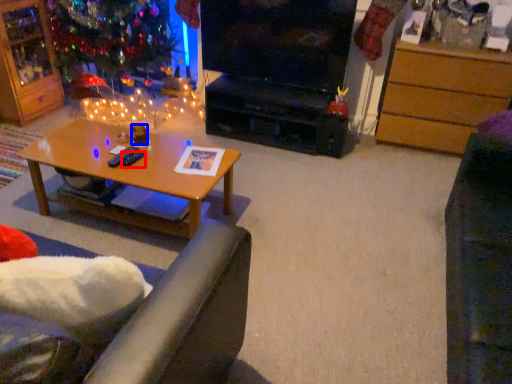
Question: Which of the following is the closest to the observer, remote control (highlighted by a red box) or coffee cup (highlighted by a blue box)?

Choices:
 (A) remote control
 (B) coffee cup

Answer: (A)